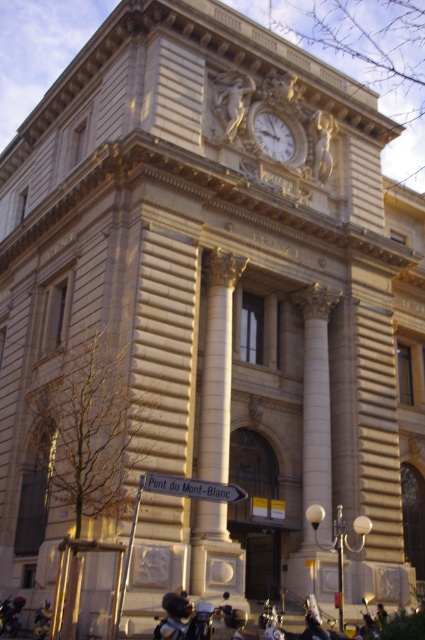
You are standing in front of the classical building and want to locate the point at coordinates point (217,364). Based on the scene description, where exactly would this point be located?

The point (217,364) is located on the golden stone column at center.

You are standing in front of the grand classical building and notice a shiny black motorcycle at lower center. Based on its coordinates, is the motorcycle closer to the left or right side of the building?

The shiny black motorcycle at lower center is located at point 0.967 on the x and y axis, which places it closer to the right side of the building.

You are standing in front of the classical building and want to determine the relative positions of two points marked on its facade. The first point is at coordinate point (212, 545) and the second at point (268, 125). Which point is closer to you?

Point (212, 545) is closer to the viewer than point (268, 125).